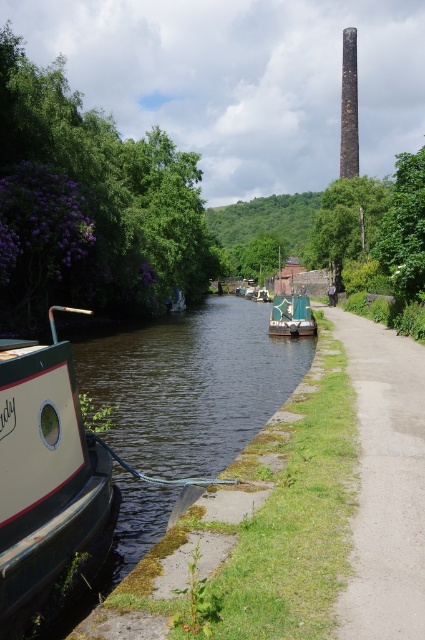
You are a photographer planning to capture the rusty brick chimney at upper center and the green leafy tree at center in a single frame. Based on their widths, which object should you focus on to ensure both fit in the shot?

The rusty brick chimney at upper center might be wider than the green leafy tree at center, so focusing on the chimney would help ensure both fit in the frame as it may require more space.

You are standing on the paved path next to the canal and want to take a photo of the green leafy tree at upper right and the green leafy tree at center. Which tree will appear larger in your photo?

The green leafy tree at upper right is much taller than the green leafy tree at center, so it will appear larger in the photo.